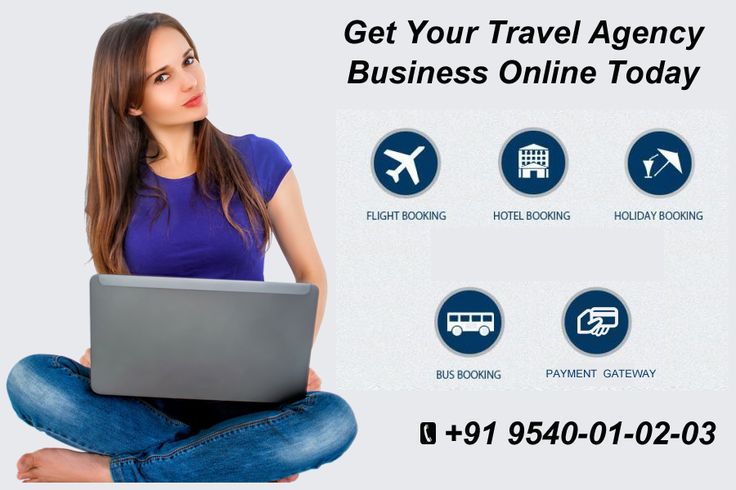
Find the location of a particular element. This screenshot has width=736, height=490. laptop is located at coordinates pyautogui.click(x=188, y=346).